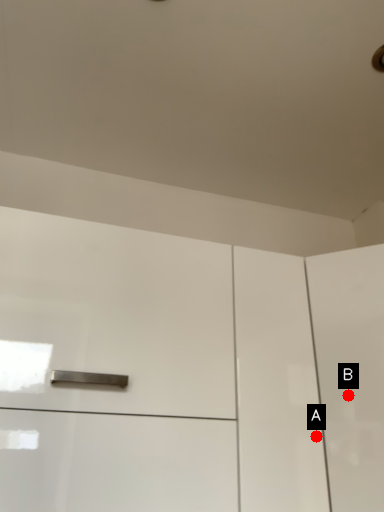
Question: Two points are circled on the image, labeled by A and B beside each circle. Which point is farther from the camera taking this photo?

Choices:
 (A) A is further
 (B) B is further

Answer: (B)